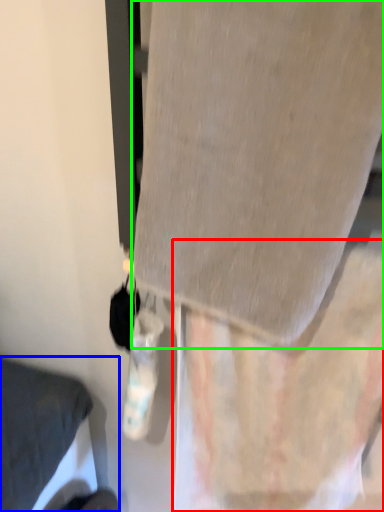
Question: Based on their relative distances, which object is farther from curtain (highlighted by a red box)? Choose from furniture (highlighted by a blue box) and fabric (highlighted by a green box).

Choices:
 (A) furniture
 (B) fabric

Answer: (A)